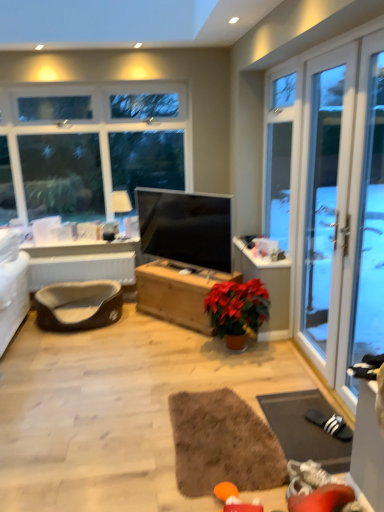
The image size is (384, 512). I want to click on free spot to the left of brown shaggy rug at center, the second yoga mat viewed from the right, so 111,439.